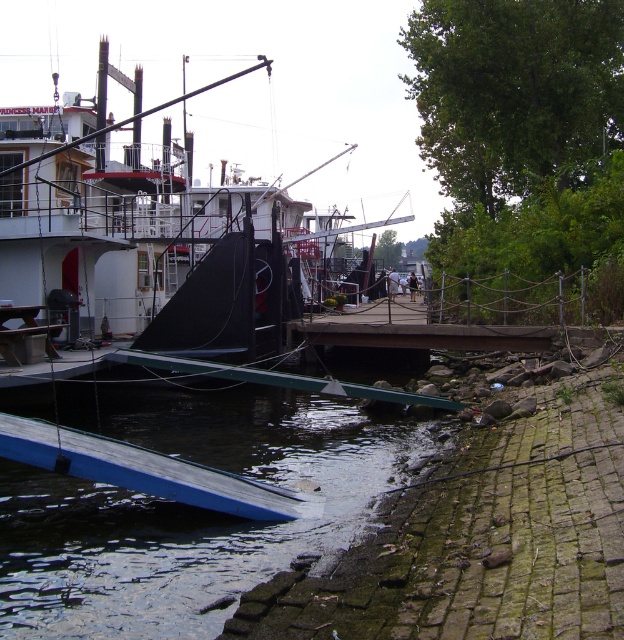
You are standing on the dock and want to walk towards the boat. There are two points marked on the dock. The first point is at coordinate point (22, 442) and the second point is at coordinate point (298, 620). Which point is closer to you as you start walking towards the boat?

Point (22, 442) is closer to you because it is further to the camera than point (298, 620), meaning it is physically nearer to your starting position on the dock.